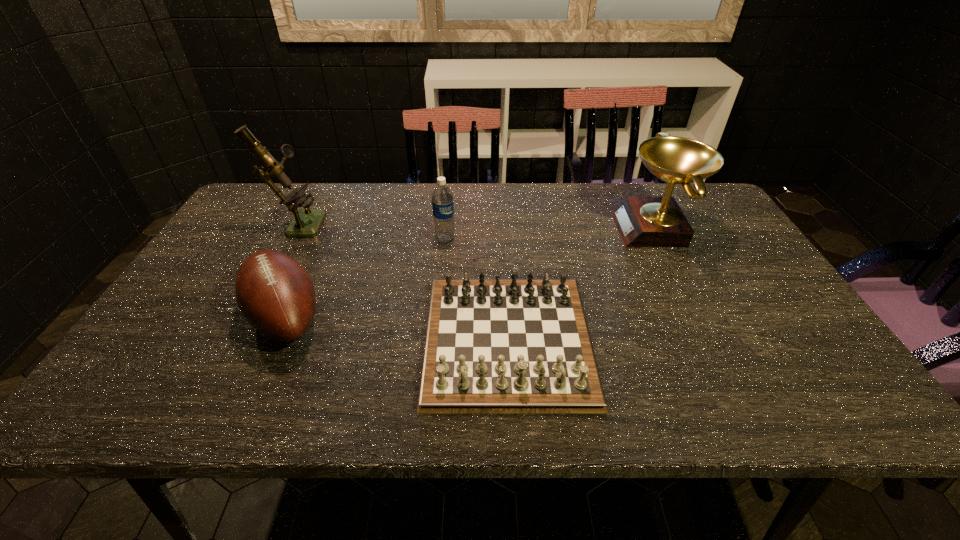
Locate an element on the screen. vacant space located 0.080m on the right of the third tallest object is located at coordinates (483, 239).

The width and height of the screenshot is (960, 540). I want to click on free region located 0.120m on the left of the football (American), so click(x=194, y=317).

The height and width of the screenshot is (540, 960). I want to click on microscope at the far edge, so click(306, 222).

At what (x,y) coordinates should I click in order to perform the action: click on award that is at the far edge. Please return your answer as a coordinate pair (x, y). This screenshot has width=960, height=540. Looking at the image, I should click on (642, 221).

At what (x,y) coordinates should I click in order to perform the action: click on object present at the near edge. Please return your answer as a coordinate pair (x, y). The image size is (960, 540). Looking at the image, I should click on (493, 346).

The image size is (960, 540). What are the coordinates of `object at the left edge` in the screenshot? It's located at (306, 222).

You are a GUI agent. You are given a task and a screenshot of the screen. Output one action in this format:
    pyautogui.click(x=<x>, y=<y>)
    Task: Click on the object that is at the right edge
    
    Given the screenshot: What is the action you would take?
    pyautogui.click(x=642, y=221)

Find the location of a particular element. This screenshot has width=960, height=540. object located at the far left corner is located at coordinates (306, 222).

This screenshot has height=540, width=960. Find the location of `object present at the far right corner`. object present at the far right corner is located at coordinates (642, 221).

The width and height of the screenshot is (960, 540). In the image, there is a desktop. What are the coordinates of `free space at the far edge` in the screenshot? It's located at (557, 199).